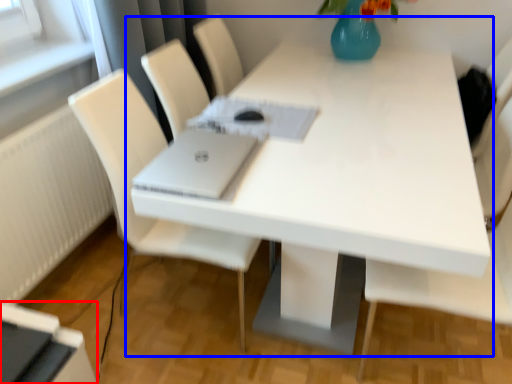
Question: Which point is further to the camera, desktop (highlighted by a red box) or table (highlighted by a blue box)?

Choices:
 (A) desktop
 (B) table

Answer: (A)